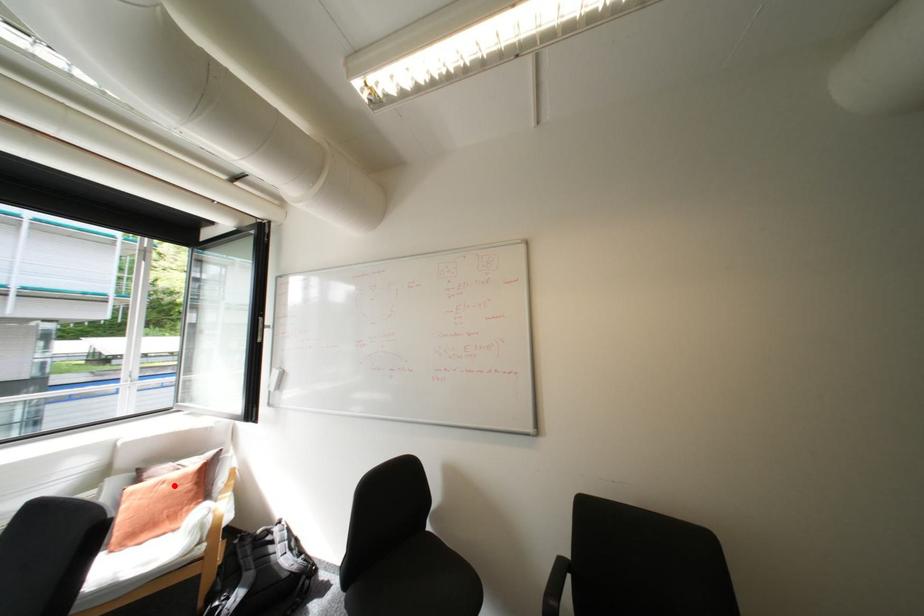
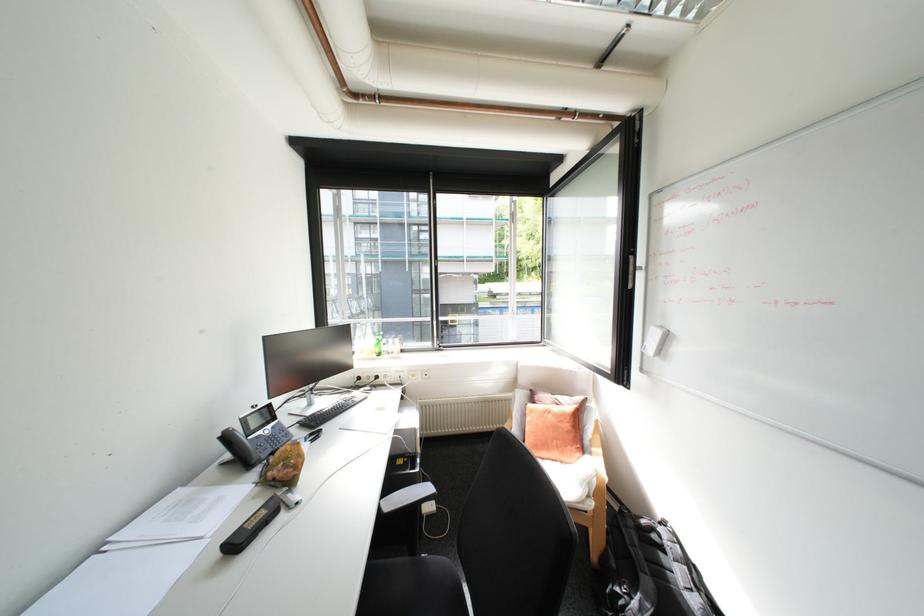
In the second image, find the point that corresponds to the highlighted location in the first image.

(561, 416)